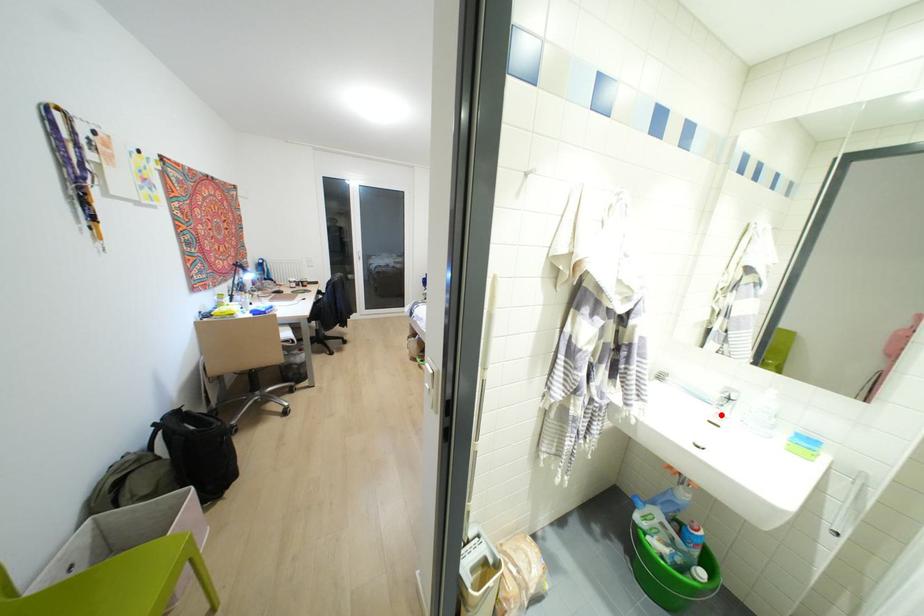
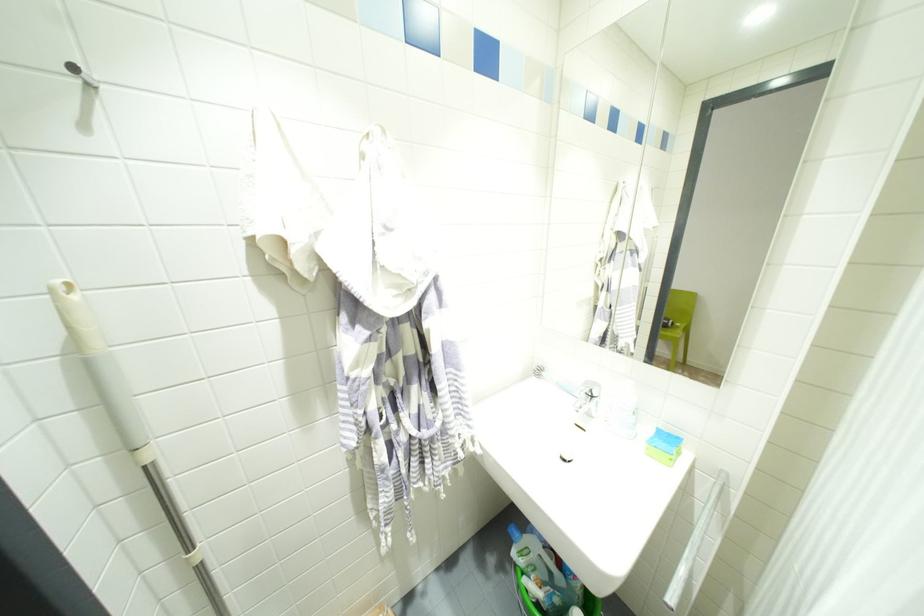
Find the pixel in the second image that matches the highlighted location in the first image.

(589, 415)